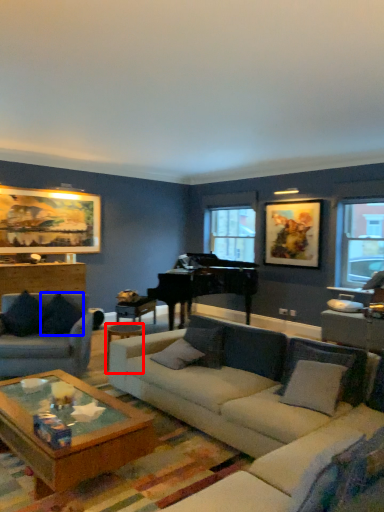
Question: Among these objects, which one is farthest to the camera, side table (highlighted by a red box) or pillow (highlighted by a blue box)?

Choices:
 (A) side table
 (B) pillow

Answer: (B)